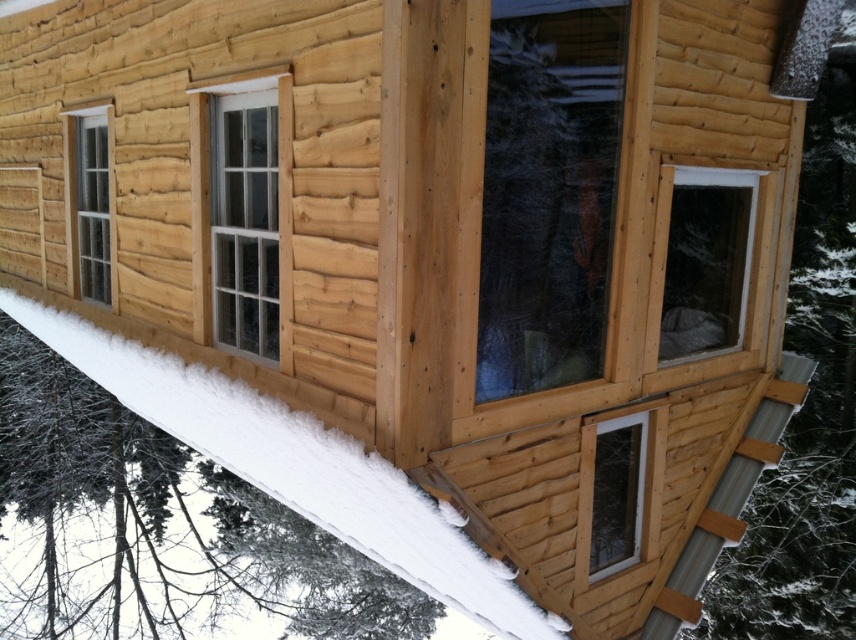
Between clear glass window at center right and clear glass window at left, which one has less height?

With less height is clear glass window at center right.

Does clear glass window at center right have a greater width compared to clear glass window at left?

Indeed, clear glass window at center right has a greater width compared to clear glass window at left.

Does point (712, 252) lie behind point (104, 296)?

No, (712, 252) is closer to viewer.

At what (x,y) coordinates should I click in order to perform the action: click on clear glass window at center right. Please return your answer as a coordinate pair (x, y). The height and width of the screenshot is (640, 856). Looking at the image, I should click on (706, 260).

From the picture: Can you confirm if clear glass window at center right is taller than white plastic window at lower right?

Indeed, clear glass window at center right has a greater height compared to white plastic window at lower right.

Can you confirm if clear glass window at center right is smaller than white plastic window at lower right?

No.

Is point (700, 257) farther from camera compared to point (604, 509)?

Yes, point (700, 257) is farther from viewer.

Identify the location of clear glass window at center right. The height and width of the screenshot is (640, 856). (706, 260).

Is clear glass window at center positioned behind clear glass window at left?

No, clear glass window at center is in front of clear glass window at left.

Can you confirm if clear glass window at center is positioned to the right of clear glass window at left?

Yes, clear glass window at center is to the right of clear glass window at left.

What do you see at coordinates (244, 212) in the screenshot? I see `clear glass window at center` at bounding box center [244, 212].

You are a GUI agent. You are given a task and a screenshot of the screen. Output one action in this format:
    pyautogui.click(x=<x>, y=<y>)
    Task: Click on the clear glass window at center
    This screenshot has width=856, height=640.
    Given the screenshot: What is the action you would take?
    pyautogui.click(x=244, y=212)